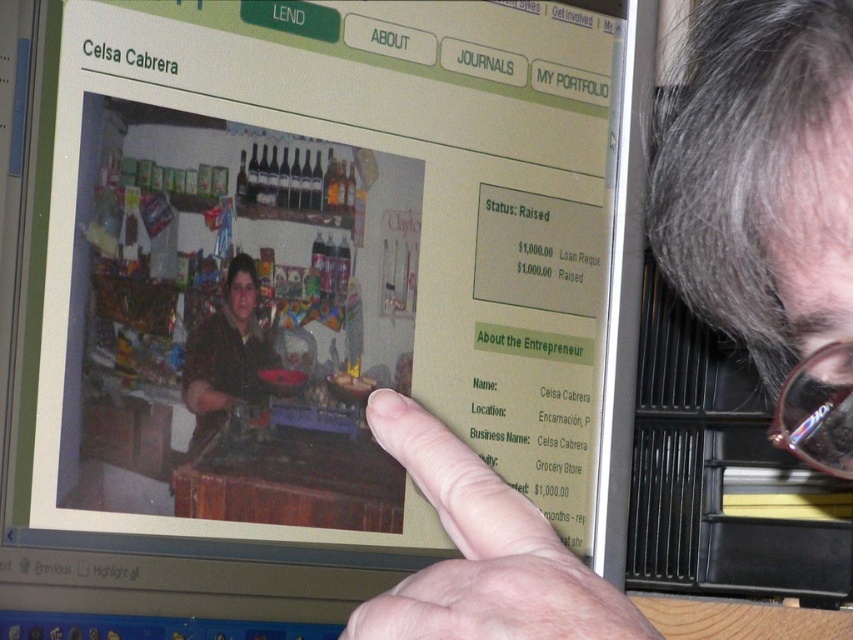
Is skinny finger at upper right thinner than clear plastic glasses at upper right?

In fact, skinny finger at upper right might be wider than clear plastic glasses at upper right.

Describe the element at coordinates (483, 552) in the screenshot. This screenshot has width=853, height=640. I see `skinny finger at upper right` at that location.

Locate an element on the screen. This screenshot has width=853, height=640. skinny finger at upper right is located at coordinates (483, 552).